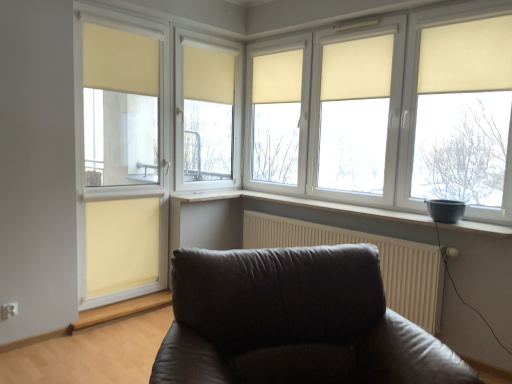
Where is `empty space that is ontop of beige fabric curtain at upper center, the 2th curtain in the right-to-left sequence (from a real-world perspective)`? This screenshot has width=512, height=384. empty space that is ontop of beige fabric curtain at upper center, the 2th curtain in the right-to-left sequence (from a real-world perspective) is located at coordinates (360, 34).